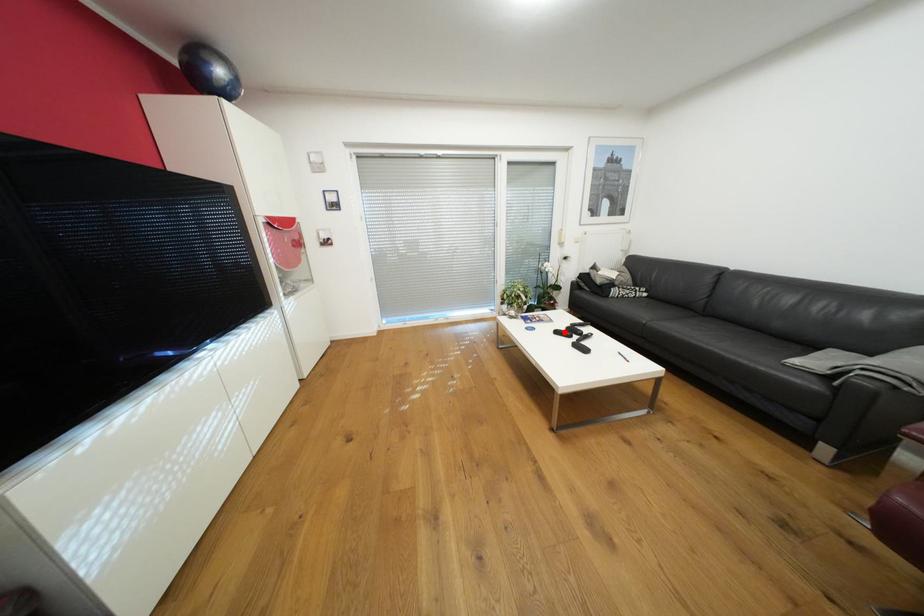
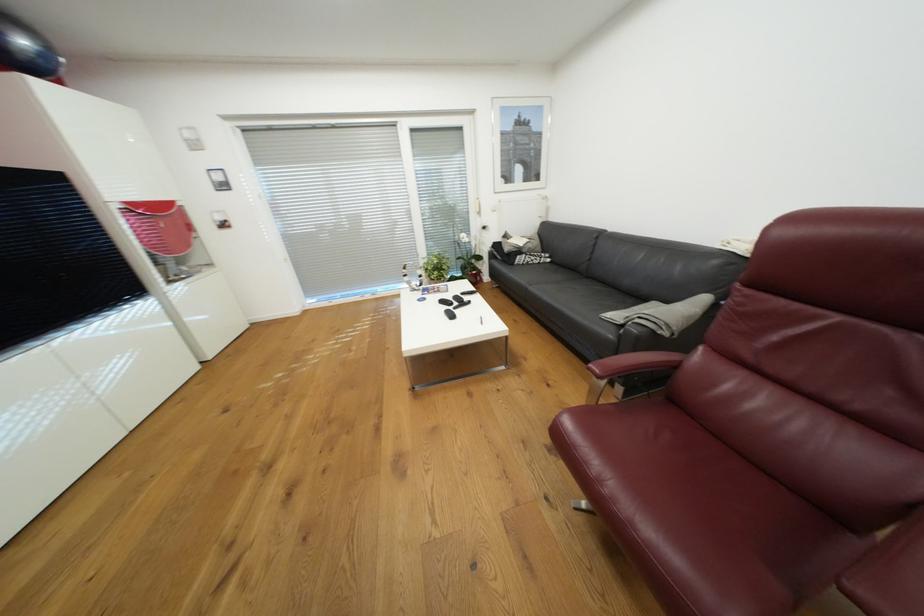
The point at the highlighted location is marked in the first image. Where is the corresponding point in the second image?

(448, 302)